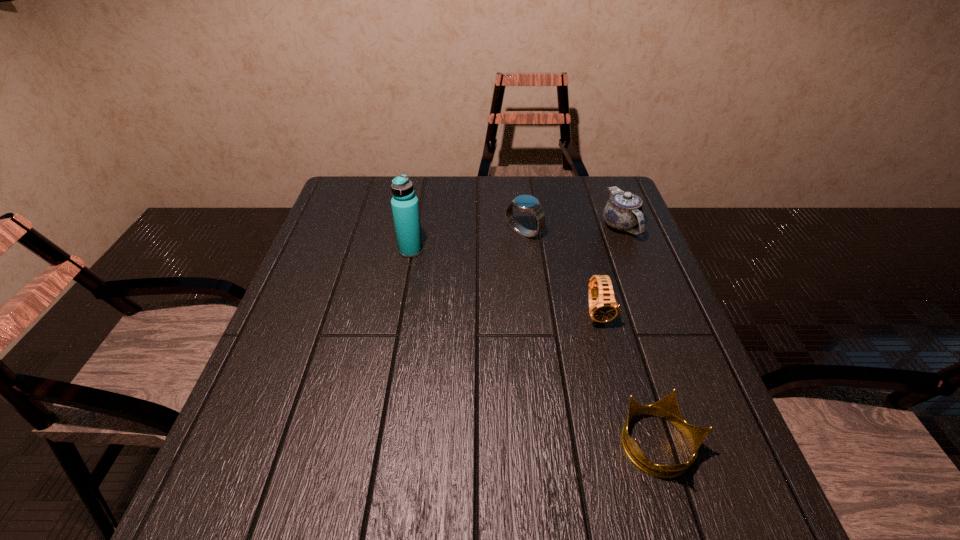
Locate an element on the screen. The width and height of the screenshot is (960, 540). vacant point located 0.180m from the spout of the chinaware is located at coordinates (645, 290).

You are a GUI agent. You are given a task and a screenshot of the screen. Output one action in this format:
    pyautogui.click(x=<x>, y=<y>)
    Task: Click on the vacant space positioned on the back of the left watch
    This screenshot has width=960, height=540.
    Given the screenshot: What is the action you would take?
    pyautogui.click(x=517, y=184)

Where is `free space located on the face of the right watch`? free space located on the face of the right watch is located at coordinates (641, 481).

Find the location of a particular element. The image size is (960, 540). vacant space located 0.270m on the left of the shortest object is located at coordinates (473, 446).

The height and width of the screenshot is (540, 960). In order to click on object located at the far edge in this screenshot , I will do `click(623, 211)`.

The width and height of the screenshot is (960, 540). Identify the location of object that is at the near edge. (667, 408).

Locate an element on the screen. This screenshot has height=540, width=960. chinaware that is at the right edge is located at coordinates (623, 211).

The height and width of the screenshot is (540, 960). In order to click on watch at the right edge in this screenshot , I will do `click(603, 307)`.

Image resolution: width=960 pixels, height=540 pixels. I want to click on crown that is at the right edge, so click(x=667, y=408).

I want to click on object that is at the far right corner, so click(x=623, y=211).